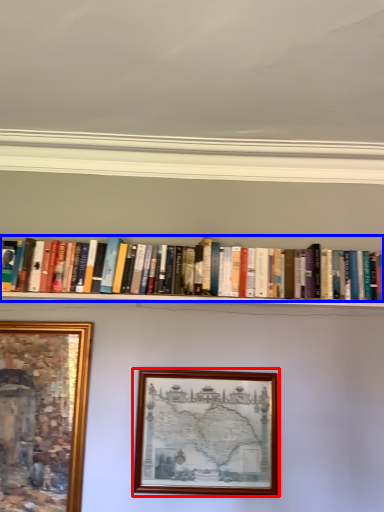
Question: Which object is further to the camera taking this photo, picture frame (highlighted by a red box) or book (highlighted by a blue box)?

Choices:
 (A) picture frame
 (B) book

Answer: (B)